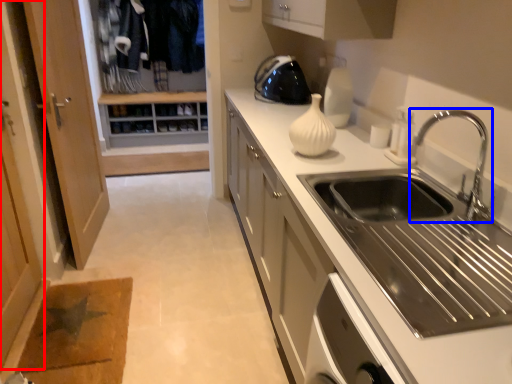
Question: Which of the following is the farthest to the observer, screen door (highlighted by a red box) or tap (highlighted by a blue box)?

Choices:
 (A) screen door
 (B) tap

Answer: (A)